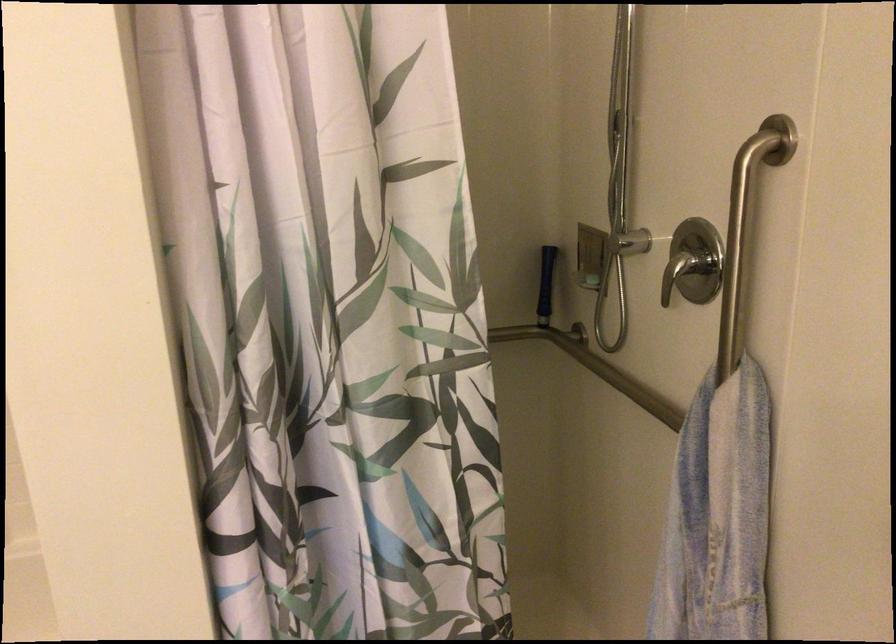
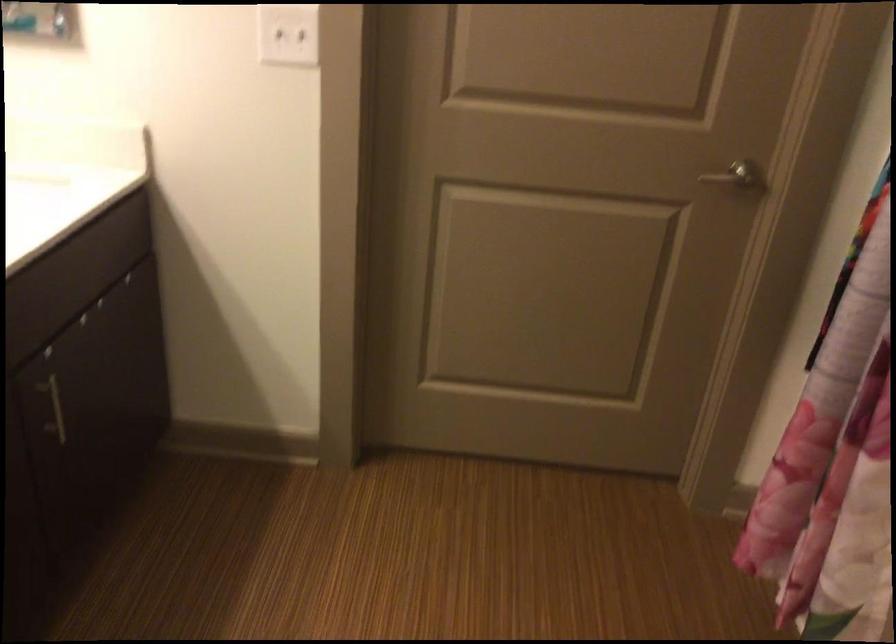
How did the camera likely rotate?

The camera's rotation is toward left-down.